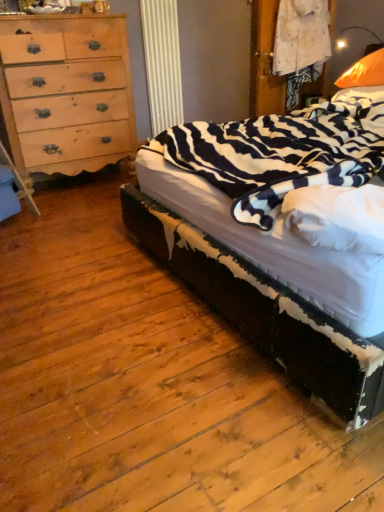
The height and width of the screenshot is (512, 384). Describe the element at coordinates (364, 72) in the screenshot. I see `orange fabric pillow at upper right` at that location.

What is the approximate height of orange fabric pillow at upper right?

orange fabric pillow at upper right is 13.42 inches in height.

You are a GUI agent. You are given a task and a screenshot of the screen. Output one action in this format:
    pyautogui.click(x=<x>, y=<y>)
    Task: Click on the zebra-patterned fabric bed at right
    The width and height of the screenshot is (384, 512).
    Given the screenshot: What is the action you would take?
    pyautogui.click(x=267, y=312)

Can we say orange fabric pillow at upper right lies outside light brown wood chest of drawers at left?

orange fabric pillow at upper right is positioned outside light brown wood chest of drawers at left.

Looking at this image, from the image's perspective, which is above, orange fabric pillow at upper right or light brown wood chest of drawers at left?

orange fabric pillow at upper right appears higher in the image.

Measure the distance from orange fabric pillow at upper right to light brown wood chest of drawers at left.

orange fabric pillow at upper right is 6.70 feet away from light brown wood chest of drawers at left.

Is point (380, 77) closer to camera compared to point (124, 106)?

Yes, it is.

Does orange fabric pillow at upper right have a smaller size compared to zebra-patterned fabric bed at right?

Indeed, orange fabric pillow at upper right has a smaller size compared to zebra-patterned fabric bed at right.

Considering the relative positions of orange fabric pillow at upper right and zebra-patterned fabric bed at right in the image provided, is orange fabric pillow at upper right behind zebra-patterned fabric bed at right?

Yes, the depth of orange fabric pillow at upper right is greater than that of zebra-patterned fabric bed at right.

From the image's perspective, relative to zebra-patterned fabric bed at right, is orange fabric pillow at upper right above or below?

orange fabric pillow at upper right is situated higher than zebra-patterned fabric bed at right in the image.

Is the surface of orange fabric pillow at upper right in direct contact with zebra-patterned fabric bed at right?

orange fabric pillow at upper right is not next to zebra-patterned fabric bed at right, and they're not touching.

Considering the positions of point (117, 125) and point (362, 86), is point (117, 125) closer or farther from the camera than point (362, 86)?

Point (117, 125) appears to be farther away from the viewer than point (362, 86).

The image size is (384, 512). What are the coordinates of `chest of drawers behind the orange fabric pillow at upper right` in the screenshot? It's located at (66, 92).

From the image's perspective, which one is positioned lower, light brown wood chest of drawers at left or orange fabric pillow at upper right?

light brown wood chest of drawers at left.

Is light brown wood chest of drawers at left positioned with its back to zebra-patterned fabric bed at right?

light brown wood chest of drawers at left does not have its back to zebra-patterned fabric bed at right.

Is the position of light brown wood chest of drawers at left more distant than that of zebra-patterned fabric bed at right?

Yes, it is.

From the image's perspective, which one is positioned lower, light brown wood chest of drawers at left or zebra-patterned fabric bed at right?

zebra-patterned fabric bed at right is shown below in the image.

Looking at this image, does light brown wood chest of drawers at left have a lesser width compared to zebra-patterned fabric bed at right?

Yes, light brown wood chest of drawers at left is thinner than zebra-patterned fabric bed at right.

Looking at this image, from the image's perspective, is zebra-patterned fabric bed at right on light brown wood chest of drawers at left?

Incorrect, from the image's perspective, zebra-patterned fabric bed at right is lower than light brown wood chest of drawers at left.

Is zebra-patterned fabric bed at right spatially inside light brown wood chest of drawers at left, or outside of it?

zebra-patterned fabric bed at right is not enclosed by light brown wood chest of drawers at left.

Considering the relative sizes of zebra-patterned fabric bed at right and light brown wood chest of drawers at left in the image provided, is zebra-patterned fabric bed at right wider than light brown wood chest of drawers at left?

Indeed, zebra-patterned fabric bed at right has a greater width compared to light brown wood chest of drawers at left.

Which of these two, zebra-patterned fabric bed at right or light brown wood chest of drawers at left, stands shorter?

zebra-patterned fabric bed at right.

Does zebra-patterned fabric bed at right turn towards orange fabric pillow at upper right?

No, zebra-patterned fabric bed at right does not turn towards orange fabric pillow at upper right.

Between zebra-patterned fabric bed at right and orange fabric pillow at upper right, which one has larger width?

zebra-patterned fabric bed at right.

Are zebra-patterned fabric bed at right and orange fabric pillow at upper right far apart?

Absolutely, zebra-patterned fabric bed at right is distant from orange fabric pillow at upper right.

From the image's perspective, is zebra-patterned fabric bed at right below orange fabric pillow at upper right?

Indeed, from the image's perspective, zebra-patterned fabric bed at right is shown beneath orange fabric pillow at upper right.

Locate an element on the screen. chest of drawers below the orange fabric pillow at upper right (from a real-world perspective) is located at coordinates (66, 92).

I want to click on pillow on the right of zebra-patterned fabric bed at right, so click(x=364, y=72).

Looking at the image, which one is located further to orange fabric pillow at upper right, light brown wood chest of drawers at left or zebra-patterned fabric bed at right?

The object further to orange fabric pillow at upper right is light brown wood chest of drawers at left.

Looking at the image, which one is located further to orange fabric pillow at upper right, zebra-patterned fabric bed at right or light brown wood chest of drawers at left?

The object further to orange fabric pillow at upper right is light brown wood chest of drawers at left.

From the image, which object appears to be farther from light brown wood chest of drawers at left, zebra-patterned fabric bed at right or orange fabric pillow at upper right?

The object further to light brown wood chest of drawers at left is orange fabric pillow at upper right.

From the image, which object appears to be farther from zebra-patterned fabric bed at right, orange fabric pillow at upper right or light brown wood chest of drawers at left?

orange fabric pillow at upper right lies further to zebra-patterned fabric bed at right than the other object.

Estimate the real-world distances between objects in this image. Which object is further from light brown wood chest of drawers at left, orange fabric pillow at upper right or zebra-patterned fabric bed at right?

orange fabric pillow at upper right is positioned further to the anchor light brown wood chest of drawers at left.

Estimate the real-world distances between objects in this image. Which object is further from zebra-patterned fabric bed at right, light brown wood chest of drawers at left or orange fabric pillow at upper right?

orange fabric pillow at upper right lies further to zebra-patterned fabric bed at right than the other object.

Where is `bed situated between light brown wood chest of drawers at left and orange fabric pillow at upper right from left to right`? This screenshot has height=512, width=384. bed situated between light brown wood chest of drawers at left and orange fabric pillow at upper right from left to right is located at coordinates (267, 312).